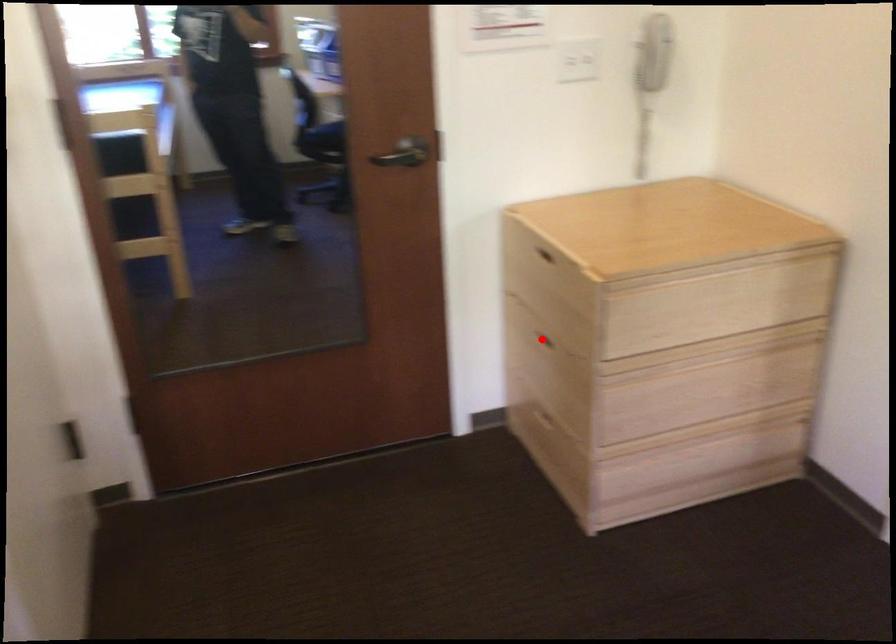
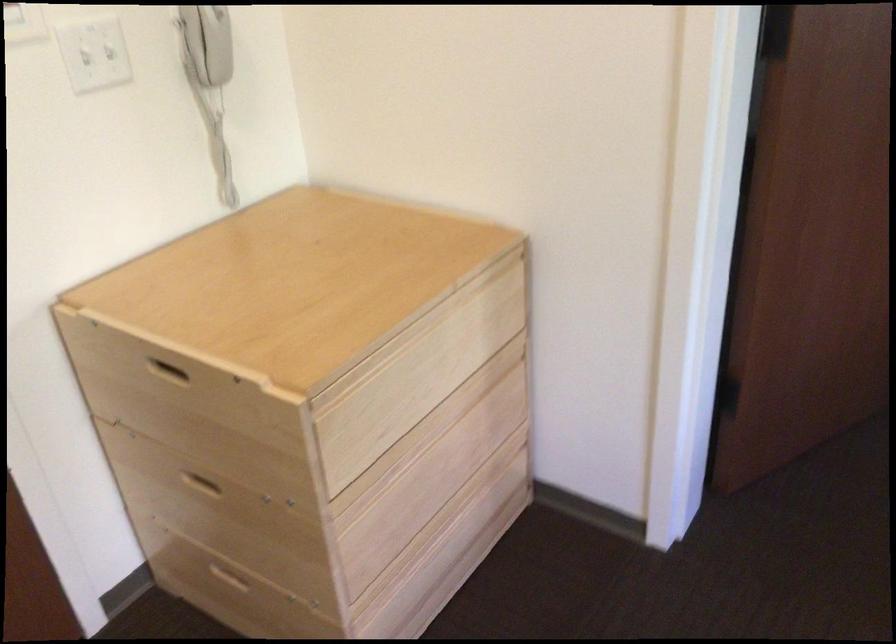
Question: I am providing you with two images of the same scene from different viewpoints. In image1, a red point is highlighted. Considering the same 3D point in image2, which of the following is correct?

Choices:
 (A) It is closer
 (B) It is farther

Answer: (A)